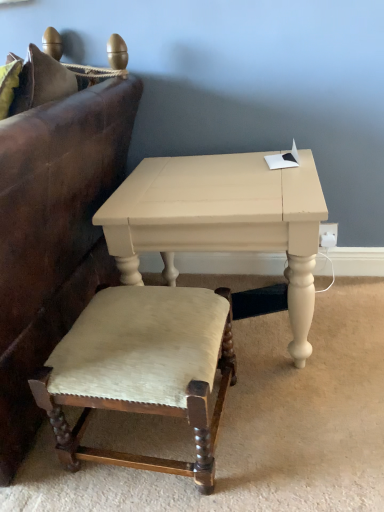
Identify the location of empty space that is to the right of velvet upholstered stool at lower left. This screenshot has width=384, height=512. (291, 431).